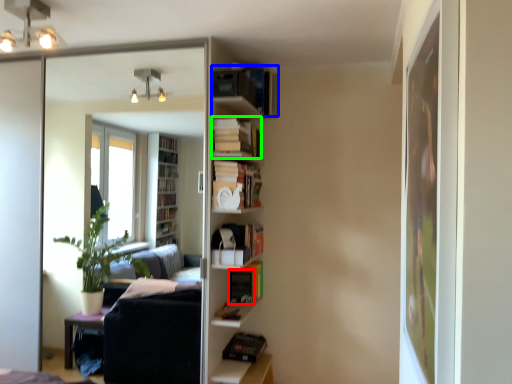
Question: Considering the real-world distances, which object is closest to book (highlighted by a red box)? book (highlighted by a blue box) or book (highlighted by a green box).

Choices:
 (A) book
 (B) book

Answer: (B)